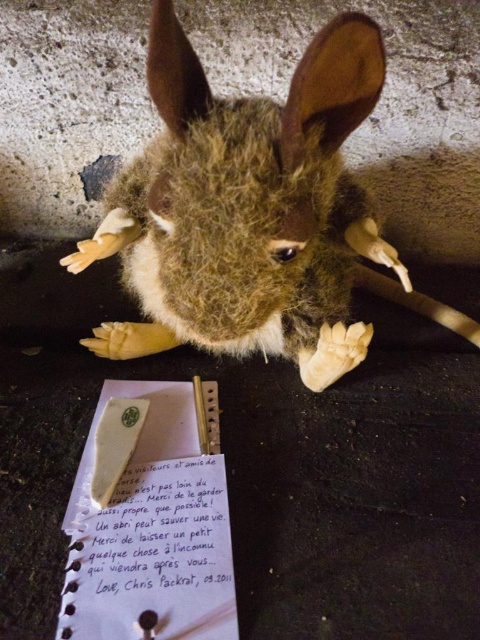
Question: Which point is farther to the camera?

Choices:
 (A) (292, 321)
 (B) (159, 490)

Answer: (A)

Question: Observing the image, what is the correct spatial positioning of fuzzy fur rabbit at center in reference to white paper at center?

Choices:
 (A) right
 (B) left

Answer: (A)

Question: Does fuzzy fur rabbit at center appear on the right side of white paper at center?

Choices:
 (A) yes
 (B) no

Answer: (A)

Question: Does fuzzy fur rabbit at center have a greater width compared to white paper at center?

Choices:
 (A) no
 (B) yes

Answer: (B)

Question: Which object is farther from the camera taking this photo?

Choices:
 (A) white paper at center
 (B) fuzzy fur rabbit at center

Answer: (A)